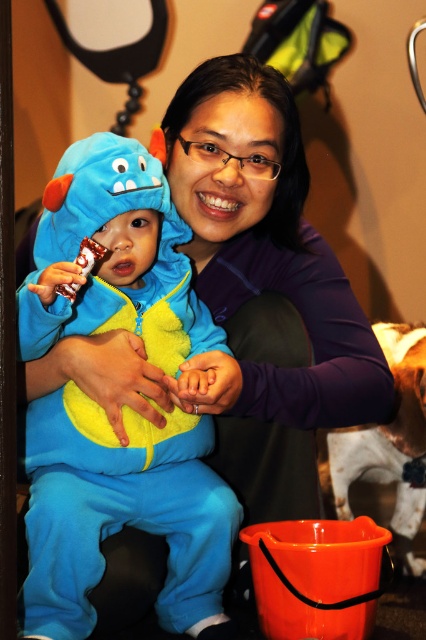
Question: Among these points, which one is farthest from the camera?

Choices:
 (A) (396, 413)
 (B) (103, 458)

Answer: (A)

Question: Can you confirm if fuzzy blue onesie at left is thinner than white fur dog at lower right?

Choices:
 (A) yes
 (B) no

Answer: (B)

Question: Which point is closer to the camera?

Choices:
 (A) white fur dog at lower right
 (B) fuzzy blue onesie at left

Answer: (B)

Question: Can you confirm if fuzzy blue onesie at left is wider than white fur dog at lower right?

Choices:
 (A) yes
 (B) no

Answer: (A)

Question: Among these points, which one is nearest to the camera?

Choices:
 (A) (417, 412)
 (B) (169, 310)

Answer: (B)

Question: Can you confirm if fuzzy blue onesie at left is wider than white fur dog at lower right?

Choices:
 (A) yes
 (B) no

Answer: (A)